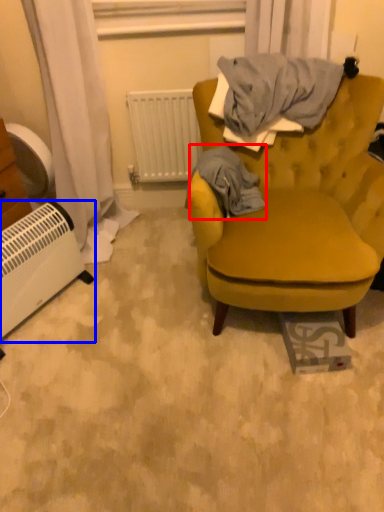
Question: Which object is further to the camera taking this photo, blanket (highlighted by a red box) or appliance (highlighted by a blue box)?

Choices:
 (A) blanket
 (B) appliance

Answer: (A)